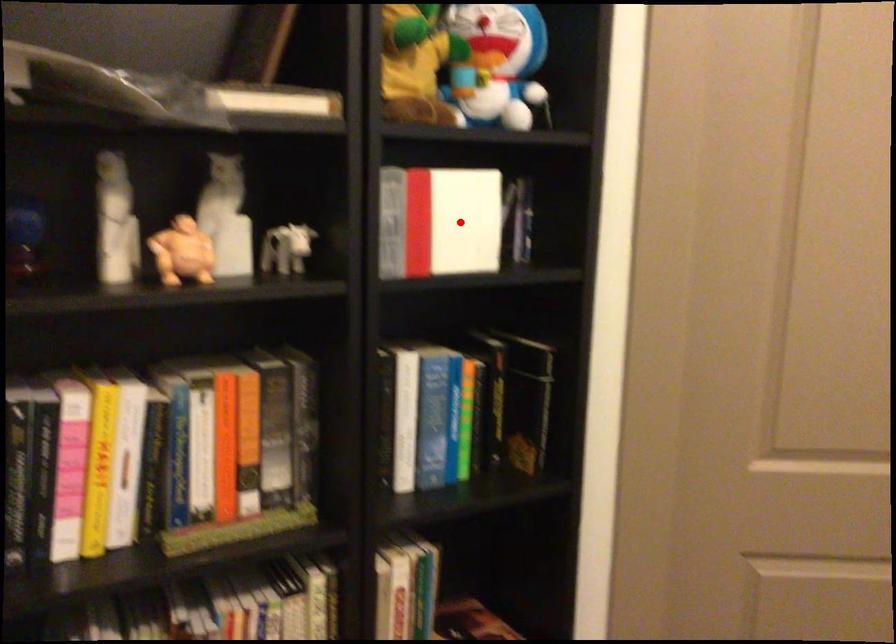
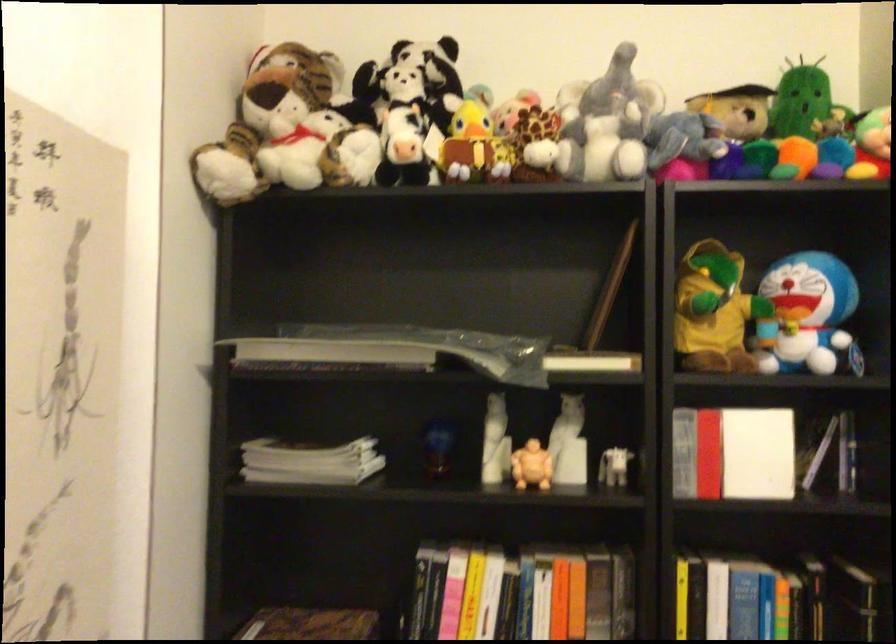
Locate, in the second image, the point that corresponds to the highlighted location in the first image.

(757, 453)